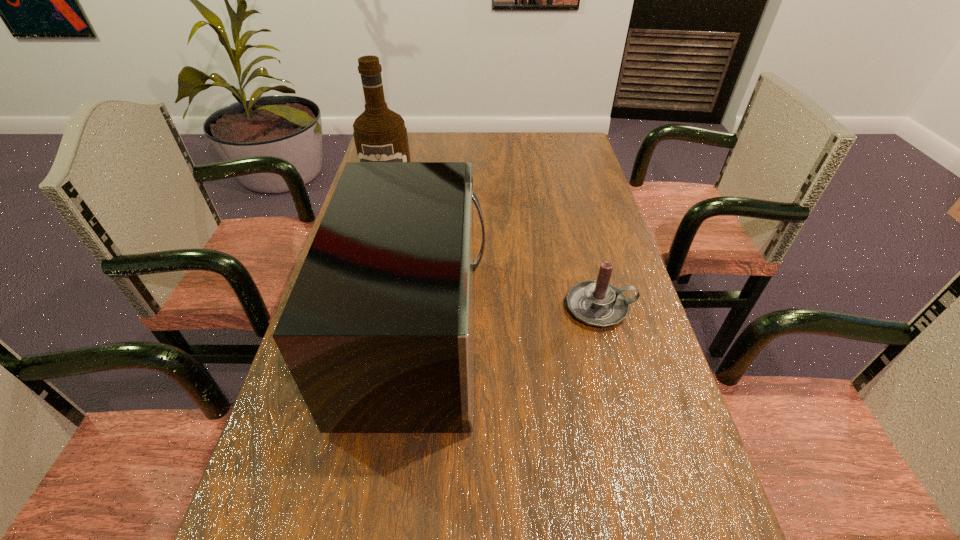
The width and height of the screenshot is (960, 540). In order to click on vacant space at the far edge of the desktop in this screenshot , I will do `click(504, 146)`.

You are a GUI agent. You are given a task and a screenshot of the screen. Output one action in this format:
    pyautogui.click(x=<x>, y=<y>)
    Task: Click on the vacant space at the left edge of the desktop
    This screenshot has height=540, width=960.
    Given the screenshot: What is the action you would take?
    [336, 491]

The image size is (960, 540). Find the location of `vacant space at the right edge`. vacant space at the right edge is located at coordinates (626, 293).

In the image, there is a desktop. At what (x,y) coordinates should I click in order to perform the action: click on free space at the far right corner. Please return your answer as a coordinate pair (x, y). Looking at the image, I should click on (571, 163).

Locate an element on the screen. Image resolution: width=960 pixels, height=540 pixels. vacant area between the alcohol and the shortest object is located at coordinates (494, 249).

You are a GUI agent. You are given a task and a screenshot of the screen. Output one action in this format:
    pyautogui.click(x=<x>, y=<y>)
    Task: Click on the free space between the second tallest object and the shortest object
    
    Given the screenshot: What is the action you would take?
    pyautogui.click(x=509, y=321)

Find the location of a particular element. The image size is (960, 540). empty location between the microwave oven and the shortest object is located at coordinates (509, 321).

You are a GUI agent. You are given a task and a screenshot of the screen. Output one action in this format:
    pyautogui.click(x=<x>, y=<y>)
    Task: Click on the unoccupied position between the alcohol and the shortest object
    This screenshot has height=540, width=960.
    Given the screenshot: What is the action you would take?
    click(x=494, y=249)

The width and height of the screenshot is (960, 540). I want to click on vacant region between the rightmost object and the microwave oven, so click(x=509, y=321).

The height and width of the screenshot is (540, 960). I want to click on blank region between the farthest object and the candle, so click(x=494, y=249).